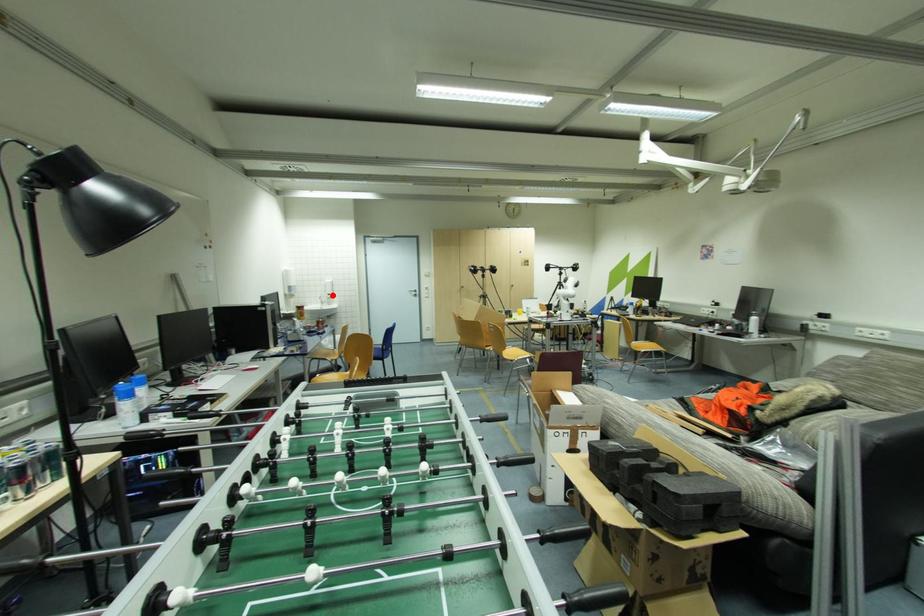
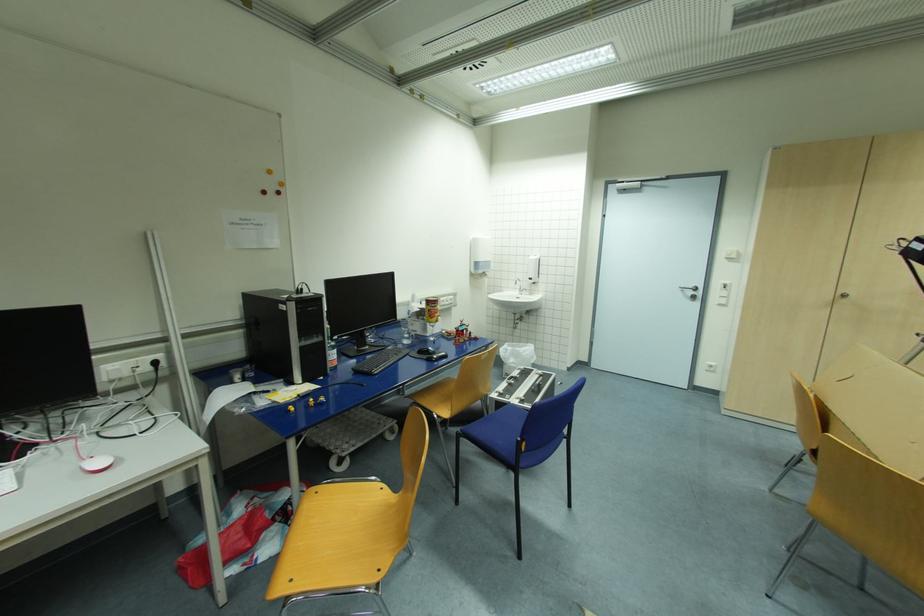
Locate, in the second image, the point that corresponds to the highlighted location in the first image.

(533, 280)